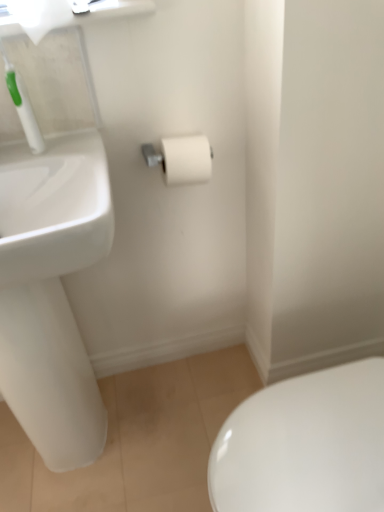
Locate an element on the screen. This screenshot has height=512, width=384. vacant area that is situated to the right of white plastic toothbrush at upper left is located at coordinates coord(82,145).